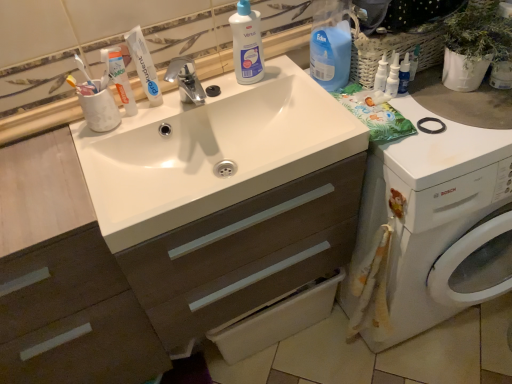
Question: From a real-world perspective, is white glossy toothpaste at upper left positioned under white glossy bottle at upper center, marked as the first cleaning product in a left-to-right arrangement, based on gravity?

Choices:
 (A) yes
 (B) no

Answer: (A)

Question: Would you say white glossy toothpaste at upper left is a long distance from white glossy bottle at upper center, marked as the first cleaning product in a left-to-right arrangement?

Choices:
 (A) yes
 (B) no

Answer: (B)

Question: From the image's perspective, is white glossy toothpaste at upper left over white glossy bottle at upper center, arranged as the fourth cleaning product when viewed from the right?

Choices:
 (A) yes
 (B) no

Answer: (B)

Question: Considering the relative sizes of white glossy toothpaste at upper left and white glossy bottle at upper center, marked as the first cleaning product in a left-to-right arrangement, in the image provided, is white glossy toothpaste at upper left wider than white glossy bottle at upper center, marked as the first cleaning product in a left-to-right arrangement,?

Choices:
 (A) yes
 (B) no

Answer: (B)

Question: Is white glossy bottle at upper center, arranged as the fourth cleaning product when viewed from the right, completely or partially inside white glossy toothpaste at upper left?

Choices:
 (A) no
 (B) yes

Answer: (A)

Question: From the image's perspective, is white glossy sink at center above or below white glossy spray bottle at upper right, positioned as the second cleaning product in right-to-left order?

Choices:
 (A) above
 (B) below

Answer: (B)

Question: From a real-world perspective, is white glossy sink at center positioned above or below white glossy spray bottle at upper right, acting as the 3th cleaning product starting from the left?

Choices:
 (A) above
 (B) below

Answer: (B)

Question: From their relative heights in the image, would you say white glossy sink at center is taller or shorter than white glossy spray bottle at upper right, positioned as the second cleaning product in right-to-left order?

Choices:
 (A) short
 (B) tall

Answer: (A)

Question: Is point (174, 157) closer or farther from the camera than point (382, 89)?

Choices:
 (A) closer
 (B) farther

Answer: (A)

Question: Is yellow-bristled toothbrush at upper left in front of or behind white glossy sink at center in the image?

Choices:
 (A) front
 (B) behind

Answer: (B)

Question: From the image's perspective, is yellow-bristled toothbrush at upper left positioned above or below white glossy sink at center?

Choices:
 (A) below
 (B) above

Answer: (B)

Question: Is point (78, 61) positioned closer to the camera than point (229, 226)?

Choices:
 (A) farther
 (B) closer

Answer: (A)

Question: Considering the relative positions of yellow-bristled toothbrush at upper left and white glossy sink at center in the image provided, is yellow-bristled toothbrush at upper left to the left or to the right of white glossy sink at center?

Choices:
 (A) left
 (B) right

Answer: (A)

Question: Is white glossy sink at center taller or shorter than white glossy toothpaste tube at upper left?

Choices:
 (A) tall
 (B) short

Answer: (B)

Question: In terms of size, does white glossy sink at center appear bigger or smaller than white glossy toothpaste tube at upper left?

Choices:
 (A) big
 (B) small

Answer: (A)